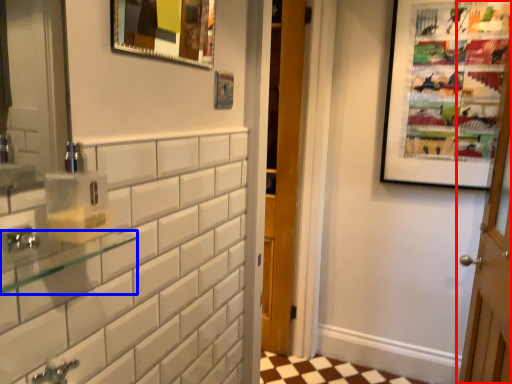
Question: Among these objects, which one is farthest to the camera, door (highlighted by a red box) or balustrade (highlighted by a blue box)?

Choices:
 (A) door
 (B) balustrade

Answer: (A)